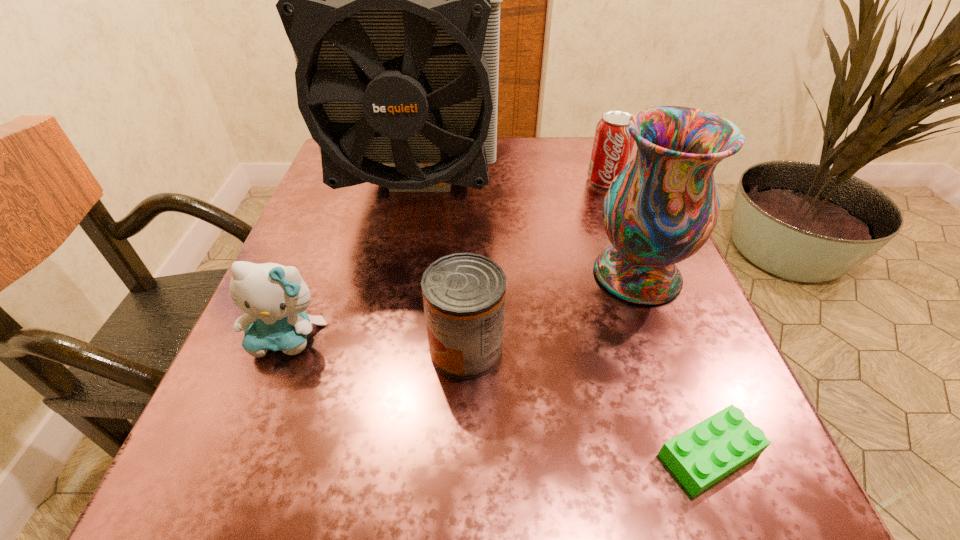
You are a GUI agent. You are given a task and a screenshot of the screen. Output one action in this format:
    pyautogui.click(x=<x>, y=<y>)
    Task: Click on the blank space at the near right corner
    The image size is (960, 540).
    Given the screenshot: What is the action you would take?
    pyautogui.click(x=673, y=514)

The image size is (960, 540). In order to click on vacant space that is in between the can and the fifth shortest object in this screenshot , I will do click(552, 312).

The height and width of the screenshot is (540, 960). In order to click on vacant area between the can and the nearest object in this screenshot , I will do `click(588, 401)`.

At what (x,y) coordinates should I click in order to perform the action: click on free space between the soda can and the can. Please return your answer as a coordinate pair (x, y). The width and height of the screenshot is (960, 540). Looking at the image, I should click on (536, 265).

This screenshot has width=960, height=540. Find the location of `blank region between the fourth nearest object and the can`. blank region between the fourth nearest object and the can is located at coordinates (552, 312).

Locate an element on the screen. The image size is (960, 540). vacant point located between the fan and the third farthest object is located at coordinates (529, 229).

Where is `vacant area between the kitten and the tallest object`? This screenshot has width=960, height=540. vacant area between the kitten and the tallest object is located at coordinates (354, 261).

You are a GUI agent. You are given a task and a screenshot of the screen. Output one action in this format:
    pyautogui.click(x=<x>, y=<y>)
    Task: Click on the vacant space that's between the tallest object and the shortest object
    This screenshot has height=540, width=960.
    Given the screenshot: What is the action you would take?
    [565, 319]

Locate an element on the screen. The width and height of the screenshot is (960, 540). the fifth closest object relative to the can is located at coordinates (612, 148).

Locate which object is the third closest to the fifth shortest object. Please provide its 2D coordinates. Your answer should be formatted as a tuple, i.e. [(x, y)], where the tuple contains the x and y coordinates of a point satisfying the conditions above.

[(612, 148)]